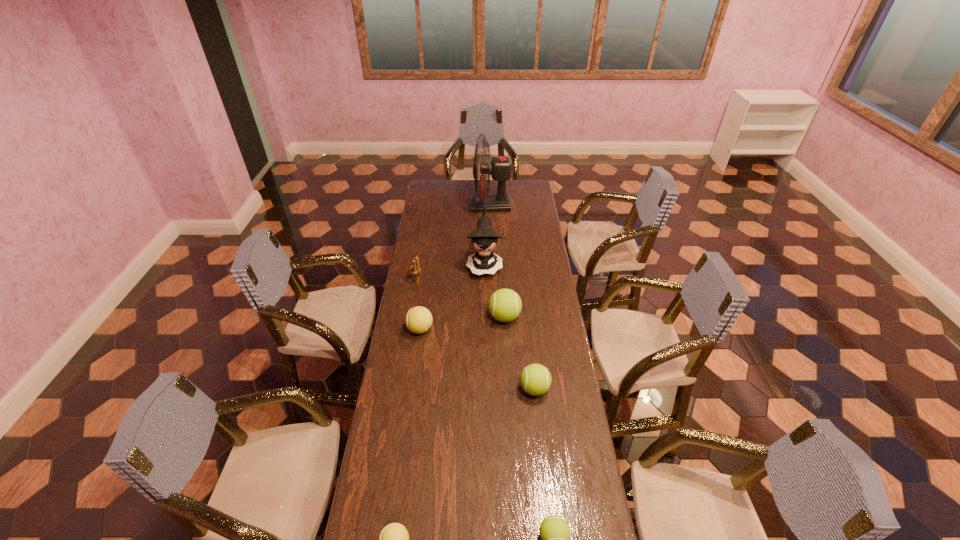
Where is `vacant space positioned 0.200m on the front-facing side of the fan`? vacant space positioned 0.200m on the front-facing side of the fan is located at coordinates (438, 206).

Where is `free region located on the front-facing side of the fan`? free region located on the front-facing side of the fan is located at coordinates 455,206.

This screenshot has width=960, height=540. What are the coordinates of `blank area located 0.190m at the face of the seventh shortest object` in the screenshot? It's located at (485, 308).

I want to click on vacant area situated on the front of the candle holder, so click(410, 328).

This screenshot has width=960, height=540. Find the location of `free space located 0.100m on the back of the biggest green tennis ball`. free space located 0.100m on the back of the biggest green tennis ball is located at coordinates (503, 291).

Locate an element on the screen. This screenshot has height=540, width=960. vacant space located on the back of the second biggest green tennis ball is located at coordinates (528, 332).

The height and width of the screenshot is (540, 960). What are the coordinates of `vacant space positioned 0.060m on the back of the farther yellow tennis ball` in the screenshot? It's located at (422, 310).

Locate an element on the screen. The image size is (960, 540). object at the far edge is located at coordinates (500, 167).

The width and height of the screenshot is (960, 540). Identify the location of candle holder located in the left edge section of the desktop. (415, 268).

The image size is (960, 540). I want to click on tennis ball present at the left edge, so click(x=418, y=320).